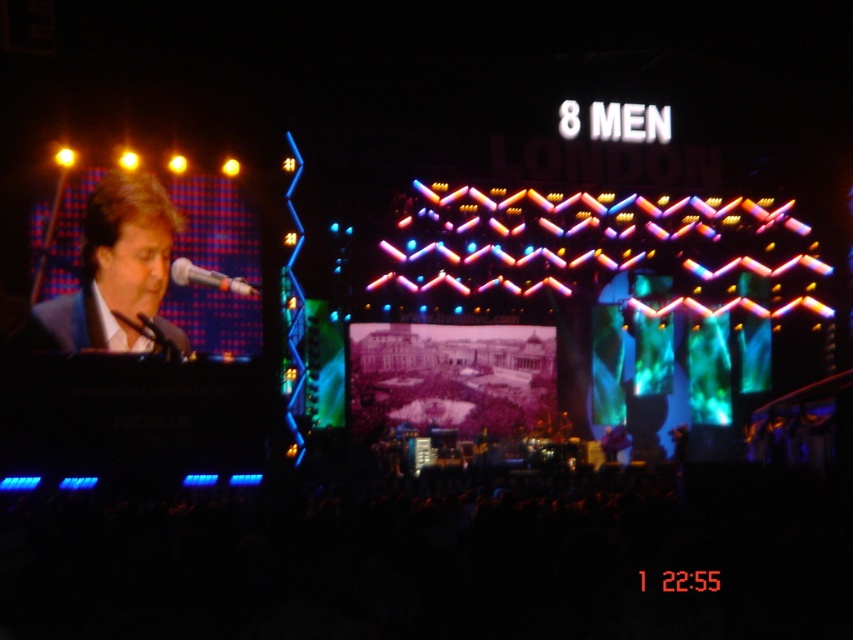
Question: Is matte black suit at left below white glossy microphone at left?

Choices:
 (A) no
 (B) yes

Answer: (A)

Question: Which point appears farthest from the camera in this image?

Choices:
 (A) (234, 280)
 (B) (85, 209)

Answer: (A)

Question: Which point is closer to the camera?

Choices:
 (A) matte black suit at left
 (B) white glossy microphone at left

Answer: (A)

Question: Considering the relative positions of matte black suit at left and white glossy microphone at left in the image provided, where is matte black suit at left located with respect to white glossy microphone at left?

Choices:
 (A) below
 (B) above

Answer: (B)

Question: Can you confirm if matte black suit at left is positioned to the right of white glossy microphone at left?

Choices:
 (A) yes
 (B) no

Answer: (B)

Question: Which of the following is the closest to the observer?

Choices:
 (A) (199, 266)
 (B) (165, 324)

Answer: (B)